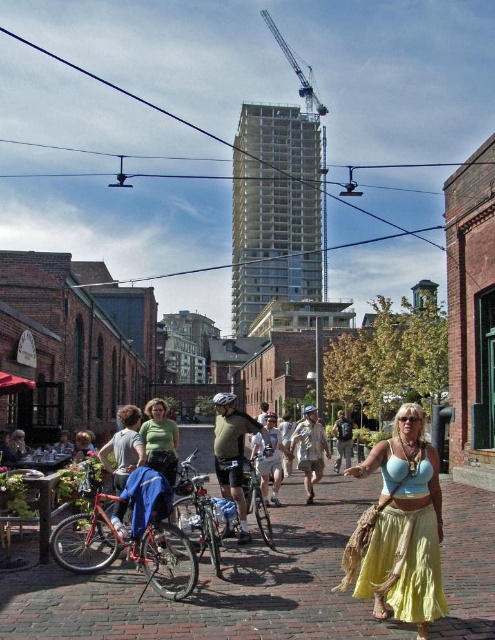
Can you confirm if matte green helmet at center is thinner than green cotton shirt at center?

Indeed, matte green helmet at center has a lesser width compared to green cotton shirt at center.

Find the location of a particular element. The image size is (495, 640). matte green helmet at center is located at coordinates (233, 452).

Image resolution: width=495 pixels, height=640 pixels. I want to click on matte green helmet at center, so click(x=233, y=452).

Is green cotton shirt at center wider than khaki cotton shorts at center?

Indeed, green cotton shirt at center has a greater width compared to khaki cotton shorts at center.

Does point (149, 413) lie in front of point (295, 435)?

Yes, point (149, 413) is in front of point (295, 435).

From the picture: Who is more forward, (163, 476) or (299, 436)?

Positioned in front is point (163, 476).

Where is `green cotton shirt at center`? Image resolution: width=495 pixels, height=640 pixels. green cotton shirt at center is located at coordinates coord(160,440).

Between matte green helmet at center and light brown leather jacket at center, which one has less height?

light brown leather jacket at center

Can you confirm if matte green helmet at center is smaller than light brown leather jacket at center?

No.

Describe the element at coordinates (233, 452) in the screenshot. I see `matte green helmet at center` at that location.

Image resolution: width=495 pixels, height=640 pixels. What are the coordinates of `matte green helmet at center` in the screenshot? It's located at 233,452.